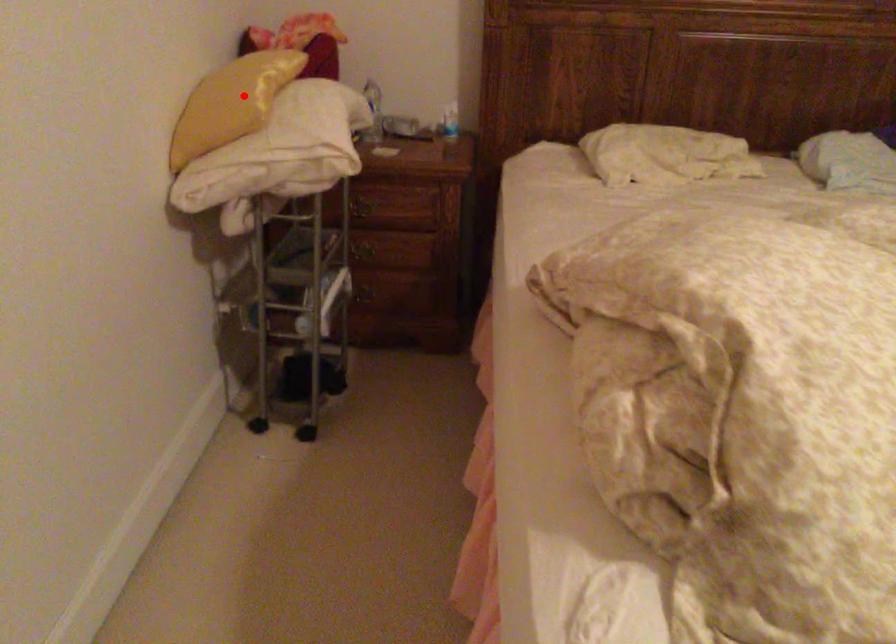
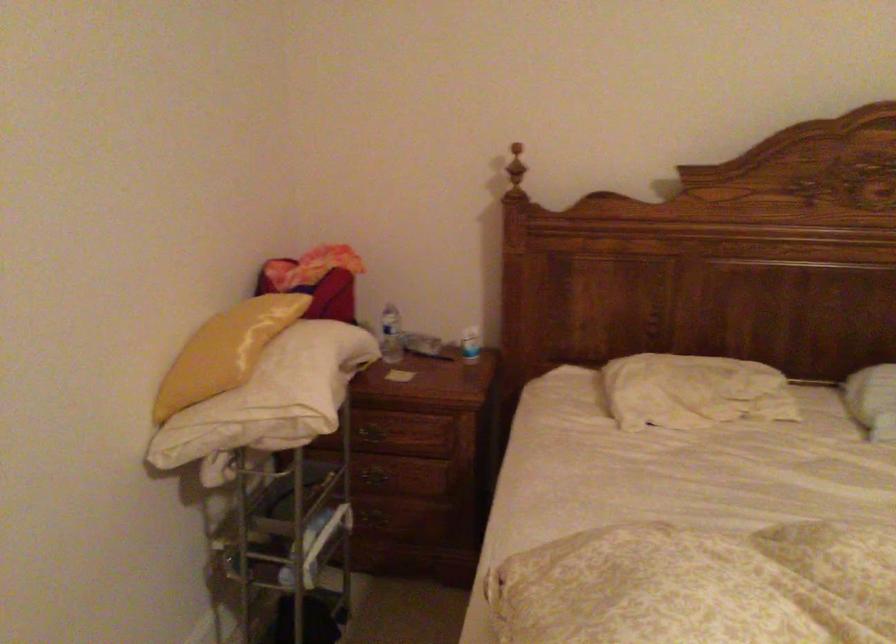
The point at the highlighted location is marked in the first image. Where is the corresponding point in the second image?

(225, 351)